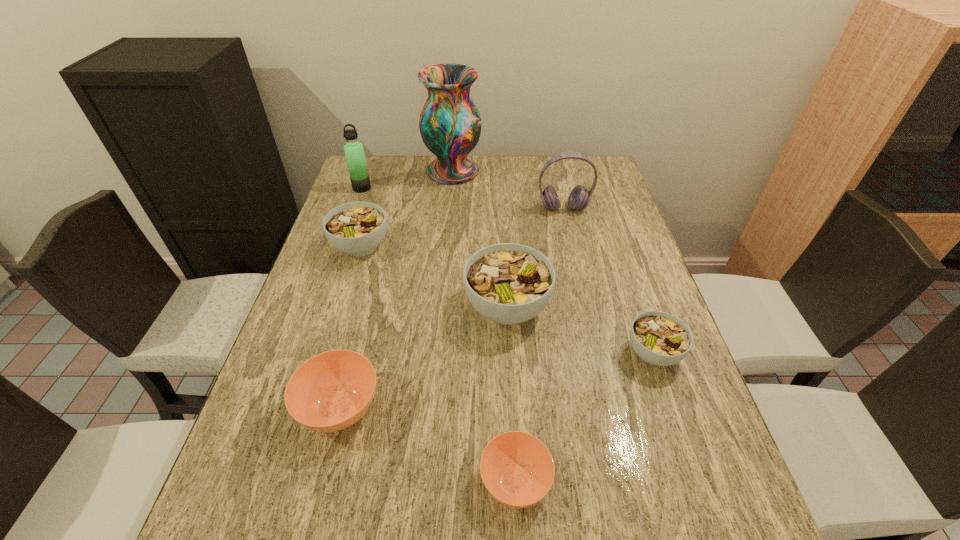
Image resolution: width=960 pixels, height=540 pixels. I want to click on vase, so click(x=450, y=124).

You are a GUI agent. You are given a task and a screenshot of the screen. Output one action in this format:
    pyautogui.click(x=<x>, y=<y>)
    Task: Click on the thermos bottle
    Image resolution: width=960 pixels, height=540 pixels.
    Given the screenshot: What is the action you would take?
    pyautogui.click(x=354, y=152)

This screenshot has height=540, width=960. Find the location of `headset`. headset is located at coordinates (579, 198).

At what (x,y) coordinates should I click in order to perform the action: click on the sixth nearest object. Please return your answer as a coordinate pair (x, y). This screenshot has width=960, height=540. Looking at the image, I should click on click(579, 198).

You are a GUI agent. You are given a task and a screenshot of the screen. Output one action in this format:
    pyautogui.click(x=<x>, y=<y>)
    Task: Click on the second white soup bowl from right to left
    This screenshot has width=960, height=540.
    Given the screenshot: What is the action you would take?
    pyautogui.click(x=507, y=283)

The width and height of the screenshot is (960, 540). I want to click on the fifth shortest object, so click(507, 283).

Where is `the farthest white soup bowl`? the farthest white soup bowl is located at coordinates (356, 228).

Image resolution: width=960 pixels, height=540 pixels. I want to click on the leftmost white soup bowl, so click(356, 228).

Image resolution: width=960 pixels, height=540 pixels. What are the coordinates of `the left peach soup bowl` in the screenshot? It's located at (331, 391).

Locate an element on the screen. the rightmost white soup bowl is located at coordinates (659, 338).